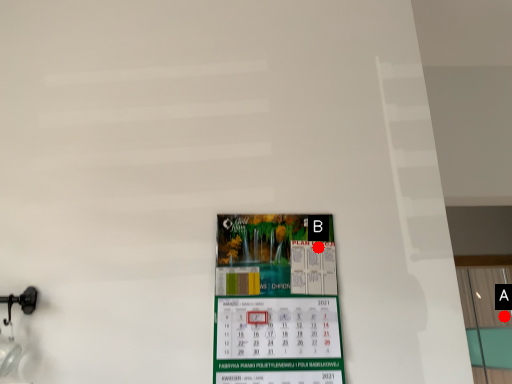
Question: Two points are circled on the image, labeled by A and B beside each circle. Which point appears closest to the camera in this image?

Choices:
 (A) A is closer
 (B) B is closer

Answer: (B)